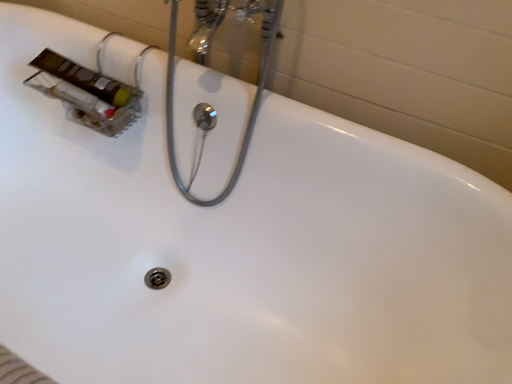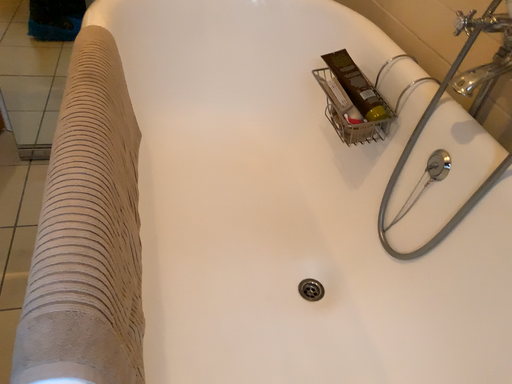
Question: Which way did the camera rotate in the video?

Choices:
 (A) rotated downward
 (B) rotated upward

Answer: (B)